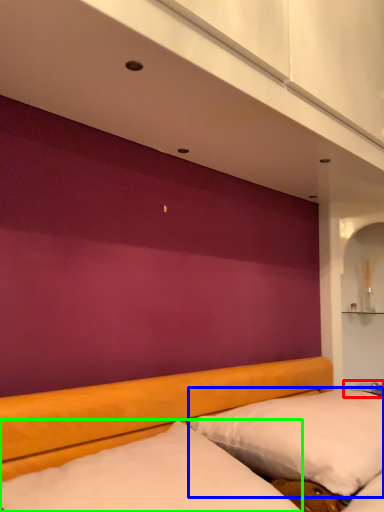
Question: Considering the real-world distances, which object is farthest from table (highlighted by a red box)? pillow (highlighted by a blue box) or mattress (highlighted by a green box)?

Choices:
 (A) pillow
 (B) mattress

Answer: (B)